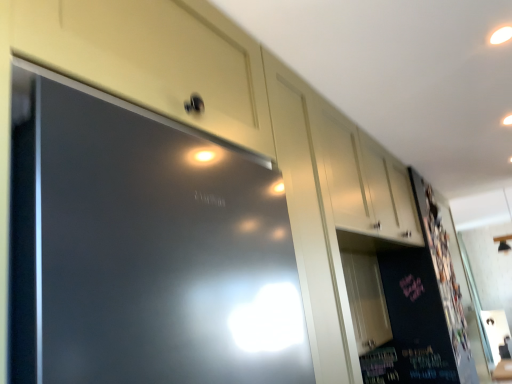
Question: From the image's perspective, is white glossy cabinet at upper center beneath dark matte board at right?

Choices:
 (A) no
 (B) yes

Answer: (A)

Question: Is white glossy cabinet at upper center positioned with its back to dark matte board at right?

Choices:
 (A) yes
 (B) no

Answer: (B)

Question: Is white glossy cabinet at upper center bigger than dark matte board at right?

Choices:
 (A) yes
 (B) no

Answer: (A)

Question: Is white glossy cabinet at upper center oriented towards dark matte board at right?

Choices:
 (A) yes
 (B) no

Answer: (B)

Question: Considering the relative sizes of white glossy cabinet at upper center and dark matte board at right in the image provided, is white glossy cabinet at upper center smaller than dark matte board at right?

Choices:
 (A) yes
 (B) no

Answer: (B)

Question: Is the surface of white glossy cabinet at upper center in direct contact with dark matte board at right?

Choices:
 (A) no
 (B) yes

Answer: (A)

Question: Does dark matte board at right have a lesser height compared to white glossy cabinet at upper center?

Choices:
 (A) yes
 (B) no

Answer: (B)

Question: Is dark matte board at right at the right side of white glossy cabinet at upper center?

Choices:
 (A) yes
 (B) no

Answer: (A)

Question: Is dark matte board at right next to white glossy cabinet at upper center?

Choices:
 (A) yes
 (B) no

Answer: (B)

Question: From the image's perspective, does dark matte board at right appear lower than white glossy cabinet at upper center?

Choices:
 (A) no
 (B) yes

Answer: (B)

Question: From a real-world perspective, is dark matte board at right on top of white glossy cabinet at upper center?

Choices:
 (A) yes
 (B) no

Answer: (B)

Question: Is dark matte board at right further to the viewer compared to white glossy cabinet at upper center?

Choices:
 (A) yes
 (B) no

Answer: (A)

Question: From a real-world perspective, is white glossy cabinet at upper center above or below dark matte board at right?

Choices:
 (A) above
 (B) below

Answer: (A)